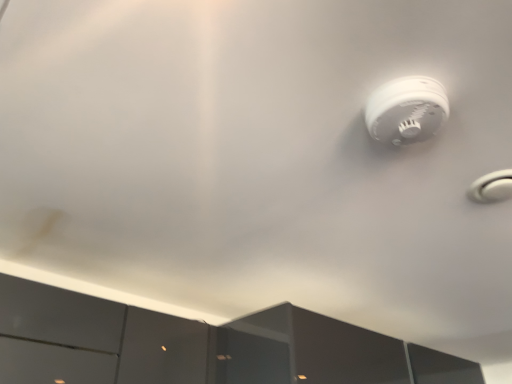
Describe the element at coordinates (406, 110) in the screenshot. Image resolution: width=512 pixels, height=384 pixels. I see `white plastic smoke detector at upper right` at that location.

Identify the location of white plastic smoke detector at upper right. (406, 110).

Find the location of a particular element. white plastic smoke detector at upper right is located at coordinates (406, 110).